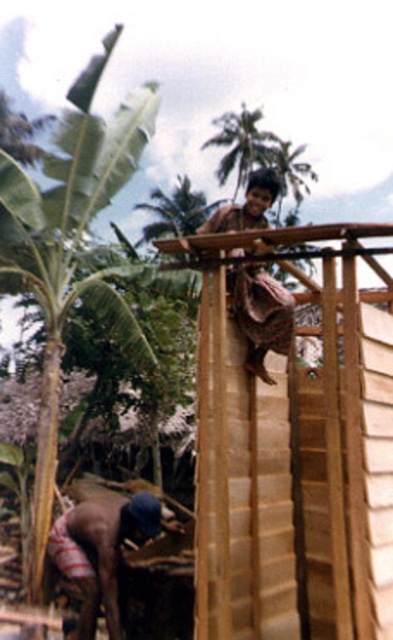
Question: Which point is closer to the camera?

Choices:
 (A) brown striped shorts at lower left
 (B) brown woven cloth at upper center
 (C) green leafy banana tree at left

Answer: (B)

Question: Is green leafy banana tree at left thinner than brown woven cloth at upper center?

Choices:
 (A) yes
 (B) no

Answer: (B)

Question: Estimate the real-world distances between objects in this image. Which object is closer to the brown striped shorts at lower left?

Choices:
 (A) brown woven cloth at upper center
 (B) green leafy banana tree at left

Answer: (A)

Question: Observing the image, what is the correct spatial positioning of green leafy banana tree at left in reference to brown striped shorts at lower left?

Choices:
 (A) above
 (B) below

Answer: (A)

Question: Is green leafy banana tree at left wider than brown woven cloth at upper center?

Choices:
 (A) yes
 (B) no

Answer: (A)

Question: Which point appears farthest from the camera in this image?

Choices:
 (A) (101, 179)
 (B) (268, 332)
 (C) (93, 627)

Answer: (A)